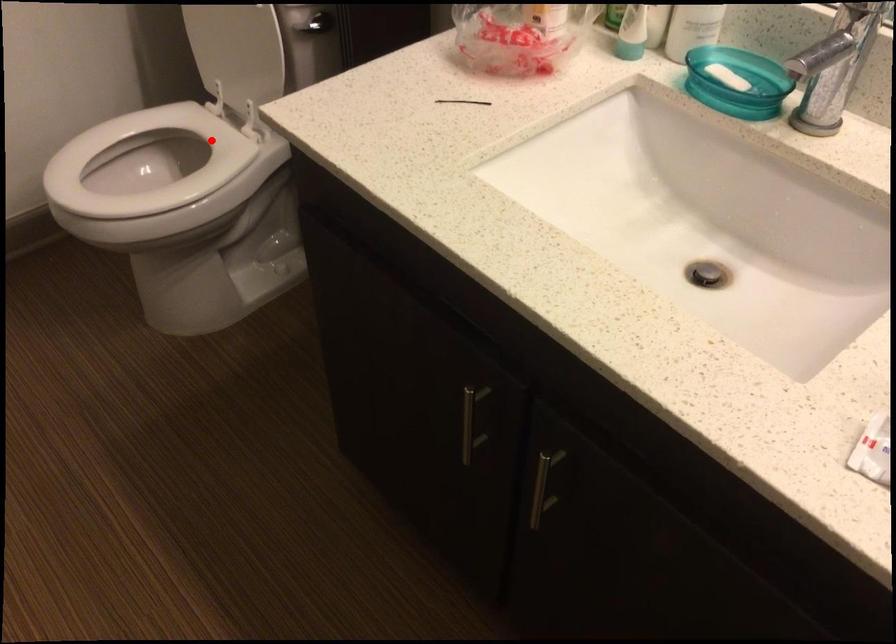
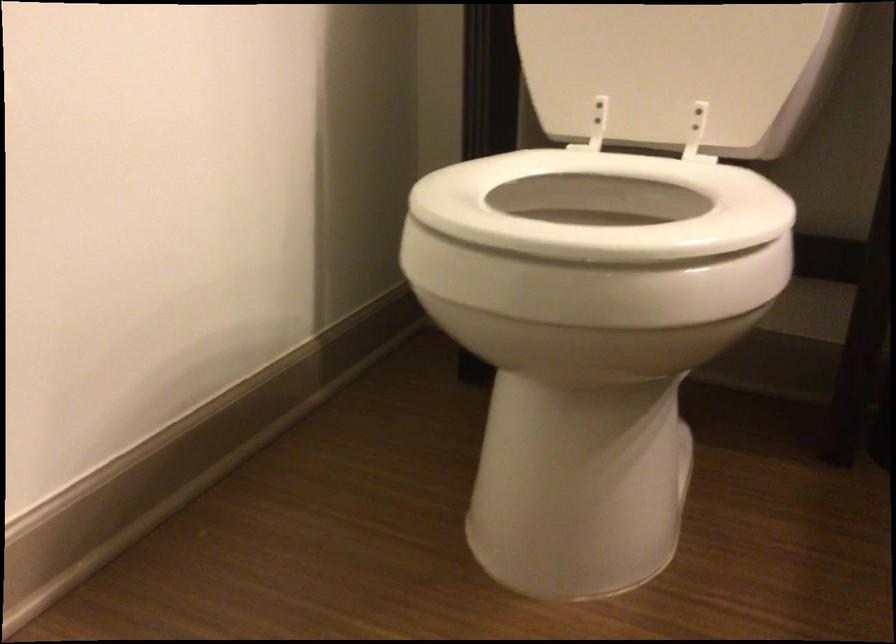
Locate, in the second image, the point that corresponds to the highlighted location in the first image.

(602, 205)